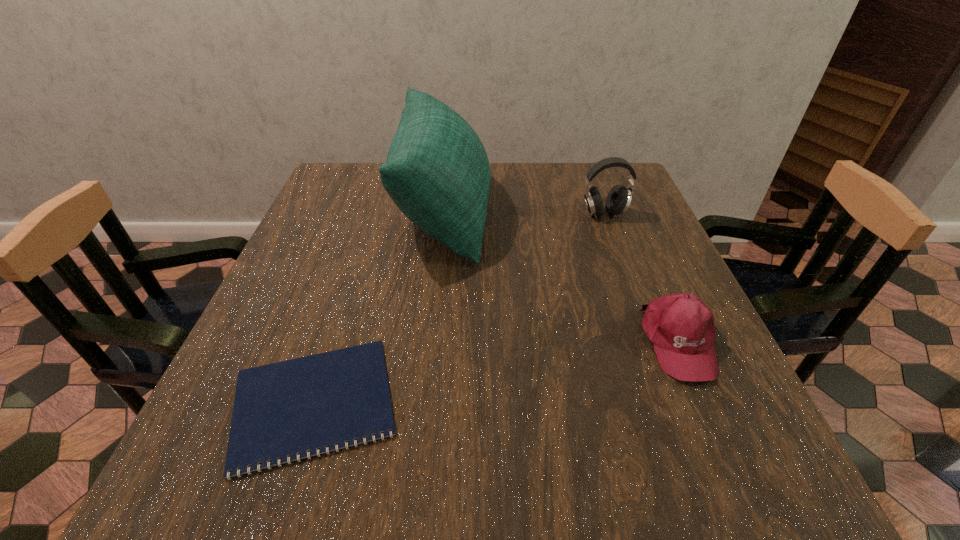
Find the location of a particular element. This screenshot has height=540, width=960. the tallest object is located at coordinates coord(437,172).

At what (x,y) coordinates should I click in order to perform the action: click on the second tallest object. Please return your answer as a coordinate pair (x, y). The image size is (960, 540). Looking at the image, I should click on (618, 200).

Find the location of `baseball cap`. baseball cap is located at coordinates (681, 328).

Locate an element on the screen. the shortest object is located at coordinates (288, 408).

The height and width of the screenshot is (540, 960). What are the coordinates of `vacant area located on the front-facing side of the cushion` in the screenshot? It's located at (612, 212).

In order to click on blank area located on the ear cups of the second tallest object in this screenshot , I will do `click(624, 269)`.

The image size is (960, 540). Identify the location of free space located 0.100m at the front of the baseball cap with the brim. (723, 441).

The height and width of the screenshot is (540, 960). What are the coordinates of `blank area located on the right of the shortest object` in the screenshot? It's located at (552, 403).

At what (x,y) coordinates should I click in order to perform the action: click on cushion that is at the far edge. Please return your answer as a coordinate pair (x, y). The image size is (960, 540). Looking at the image, I should click on (437, 172).

What are the coordinates of `headset that is at the far edge` in the screenshot? It's located at click(618, 200).